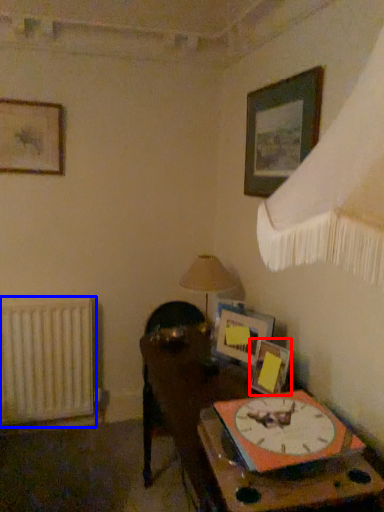
Question: Which point is closer to the camera, picture frame (highlighted by a red box) or radiator (highlighted by a blue box)?

Choices:
 (A) picture frame
 (B) radiator

Answer: (A)